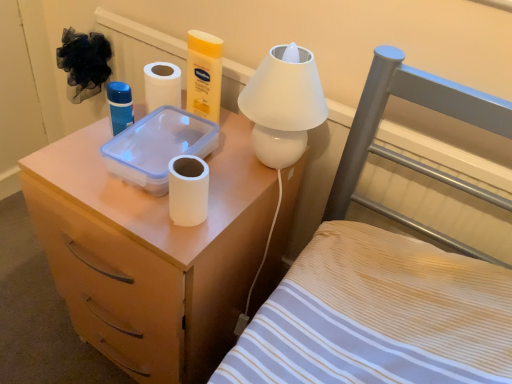
Identify the location of free spot behind white matte toilet paper at center. (234, 173).